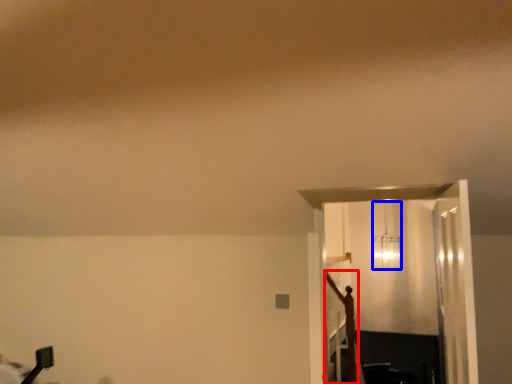
Question: Among these objects, which one is farthest to the camera, crucifix (highlighted by a red box) or lamp (highlighted by a blue box)?

Choices:
 (A) crucifix
 (B) lamp

Answer: (B)